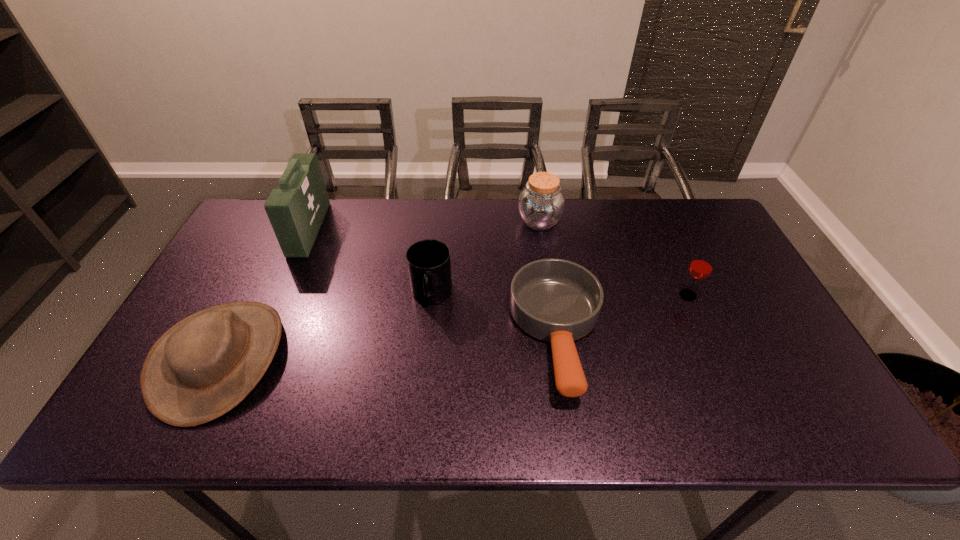
The height and width of the screenshot is (540, 960). I want to click on free area in between the shortest object and the third object from left to right, so click(x=494, y=315).

Locate an element on the screen. The image size is (960, 540). free space between the fifth tallest object and the jar is located at coordinates (380, 290).

Image resolution: width=960 pixels, height=540 pixels. In order to click on free point between the pan and the glass in this screenshot , I will do `click(623, 315)`.

In order to click on object that stands as the third closest to the shortest object in this screenshot , I will do `click(701, 266)`.

Where is `object identified as the fifth closest to the pan`? object identified as the fifth closest to the pan is located at coordinates (296, 209).

Locate an element on the screen. This screenshot has height=540, width=960. free region that satisfies the following two spatial constraints: 1. on the back side of the fifth tallest object; 2. on the left side of the rightmost object is located at coordinates (252, 295).